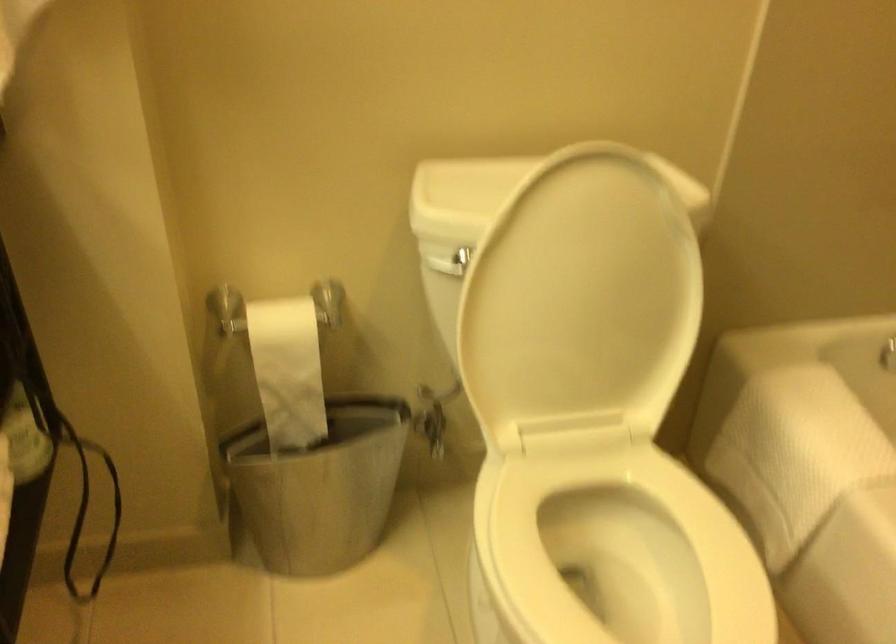
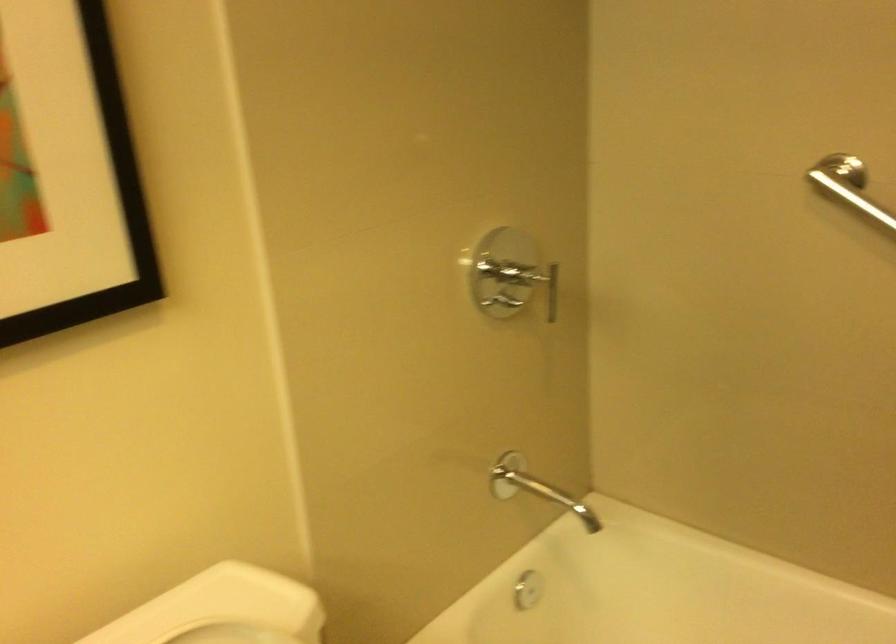
Where in the second image is the point corresponding to [640,176] from the first image?

(231, 634)